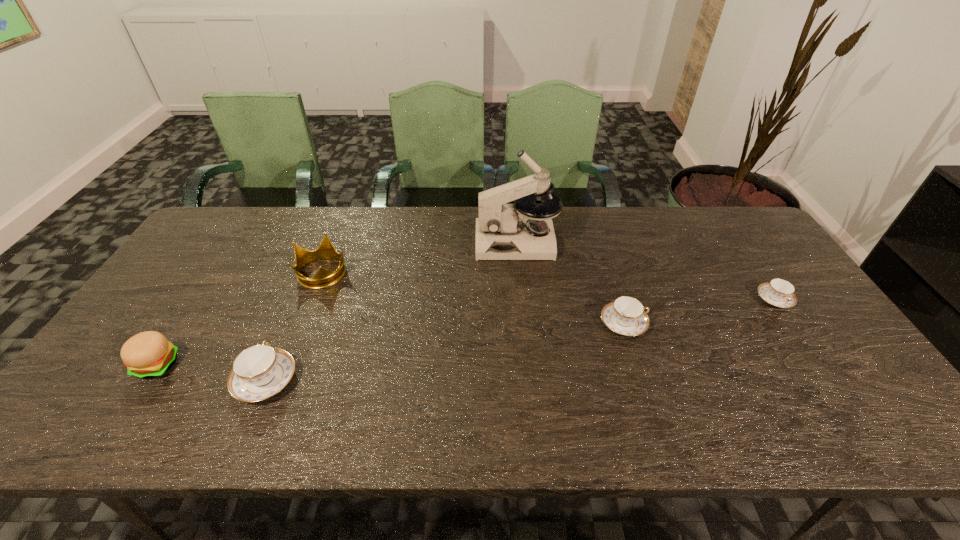
In the image, there is a desktop. Identify the location of vacant area at the far right corner. Image resolution: width=960 pixels, height=540 pixels. (709, 226).

Locate an element on the screen. free spot between the leftmost teacup and the crown is located at coordinates (295, 326).

I want to click on free space that is in between the hamburger and the tallest object, so click(337, 303).

The height and width of the screenshot is (540, 960). I want to click on vacant space that is in between the tallest teacup and the rightmost object, so click(x=519, y=340).

Image resolution: width=960 pixels, height=540 pixels. I want to click on free area in between the crown and the second tallest teacup, so click(x=473, y=298).

At what (x,y) coordinates should I click in order to perform the action: click on free space between the second shortest object and the rightmost teacup. Please return your answer as a coordinate pair (x, y). Image resolution: width=960 pixels, height=540 pixels. Looking at the image, I should click on (699, 311).

You are a GUI agent. You are given a task and a screenshot of the screen. Output one action in this format:
    pyautogui.click(x=<x>, y=<y>)
    Task: Click on the free space that is in between the microscope and the tallest teacup
    
    Given the screenshot: What is the action you would take?
    pyautogui.click(x=391, y=312)

Locate an element on the screen. free space that is in between the rightmost teacup and the third object from right to left is located at coordinates (645, 271).

What are the coordinates of `vacant point located between the shortest teacup and the leftmost object` in the screenshot? It's located at (466, 332).

At what (x,y) coordinates should I click in order to perform the action: click on empty space that is in between the fifth object from left to right and the leftmost teacup. Please return your answer as a coordinate pair (x, y). This screenshot has width=960, height=540. Looking at the image, I should click on (444, 352).